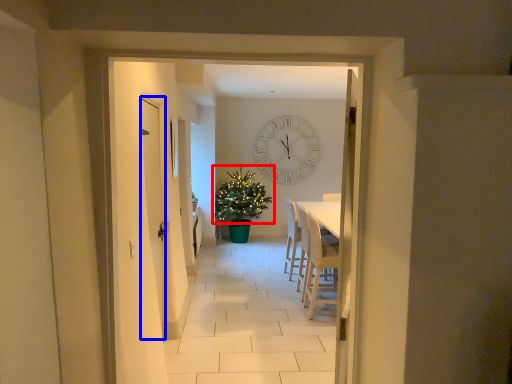
Question: Which of the following is the farthest to the observer, christmas tree (highlighted by a red box) or door (highlighted by a blue box)?

Choices:
 (A) christmas tree
 (B) door

Answer: (A)